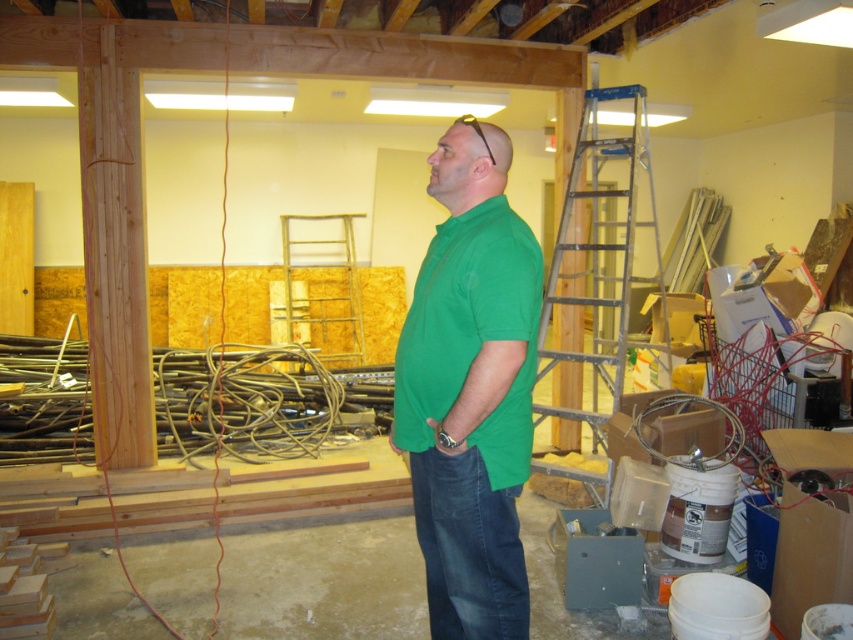
You are a construction worker standing at the point labeled point (325, 248). You need to move to the point labeled point (590, 417). Which direction should you move to get closer to your destination?

To move from point (325, 248) to point (590, 417), you should move towards the direction of the ladder leaning against the wall since point (590, 417) is closer to the viewer than point (325, 248).